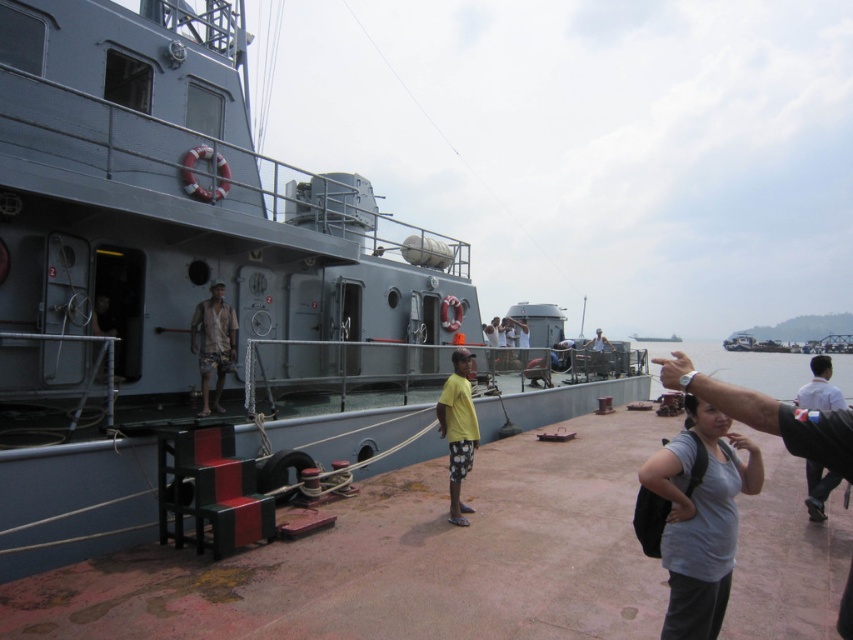
Can you confirm if gray matte boat at center is positioned below white shirt at right?

No.

Which is in front, point (15, 476) or point (809, 465)?

Point (15, 476)

Locate an element on the screen. The width and height of the screenshot is (853, 640). gray matte boat at center is located at coordinates (193, 275).

Does camouflage shorts at center have a greater height compared to white shirt at right?

Yes, camouflage shorts at center is taller than white shirt at right.

Can you confirm if camouflage shorts at center is positioned to the right of white shirt at right?

Incorrect, camouflage shorts at center is not on the right side of white shirt at right.

Find the location of `camouflage shorts at center`. camouflage shorts at center is located at coordinates (213, 342).

Image resolution: width=853 pixels, height=640 pixels. Identify the location of camouflage shorts at center. (213, 342).

Which is below, white shirt at right or metallic helmet at center?

white shirt at right is lower down.

Which is above, white shirt at right or metallic helmet at center?

metallic helmet at center is above.

Who is more distant from viewer, (834, 406) or (601, 376)?

The point (601, 376) is more distant.

I want to click on white shirt at right, so click(x=819, y=387).